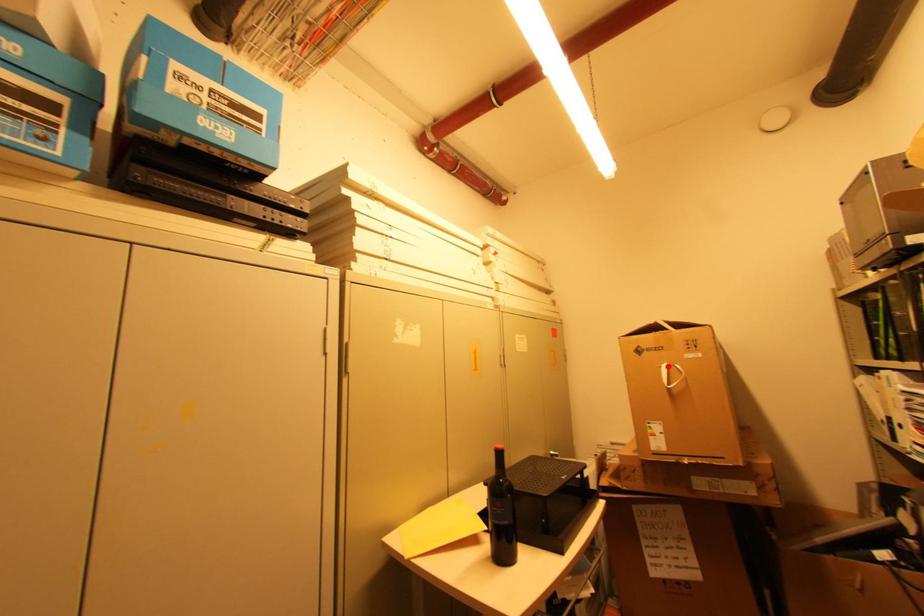
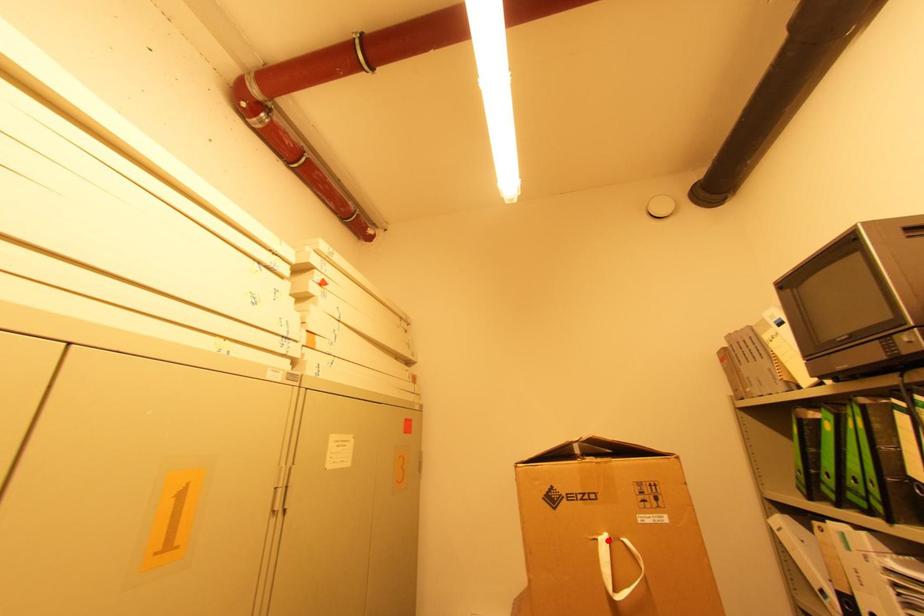
I am providing you with two images of the same scene from different viewpoints. A red point is marked on the first image and another point is marked on the second image. Do the highlighted points in image1 and image2 indicate the same real-world spot?

Yes